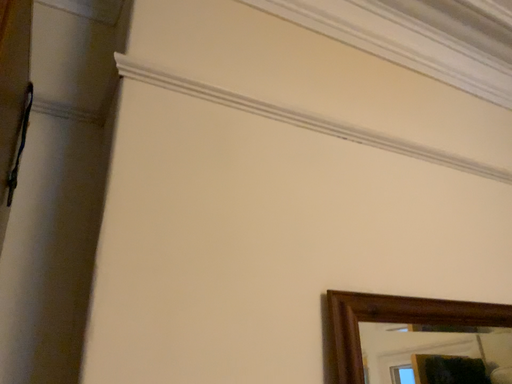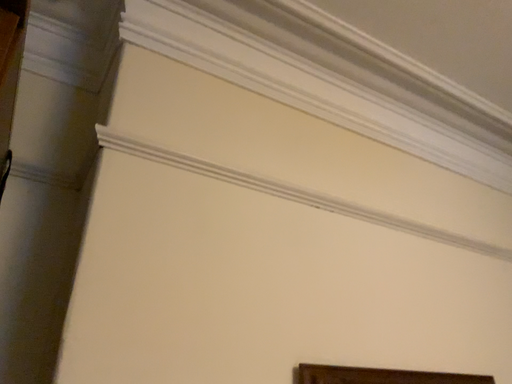
Question: How did the camera likely rotate when shooting the video?

Choices:
 (A) rotated downward
 (B) rotated upward

Answer: (B)